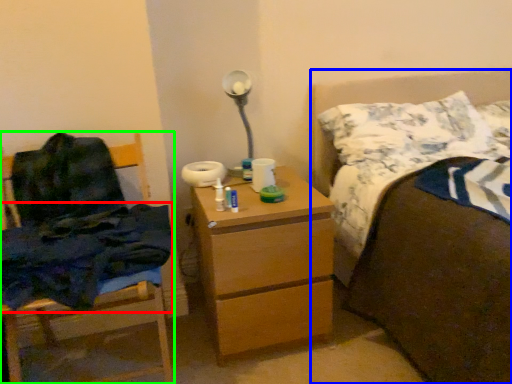
Question: Based on their relative distances, which object is nearer to blanket (highlighted by a red box)? Choose from bed (highlighted by a blue box) and chair (highlighted by a green box).

Choices:
 (A) bed
 (B) chair

Answer: (B)